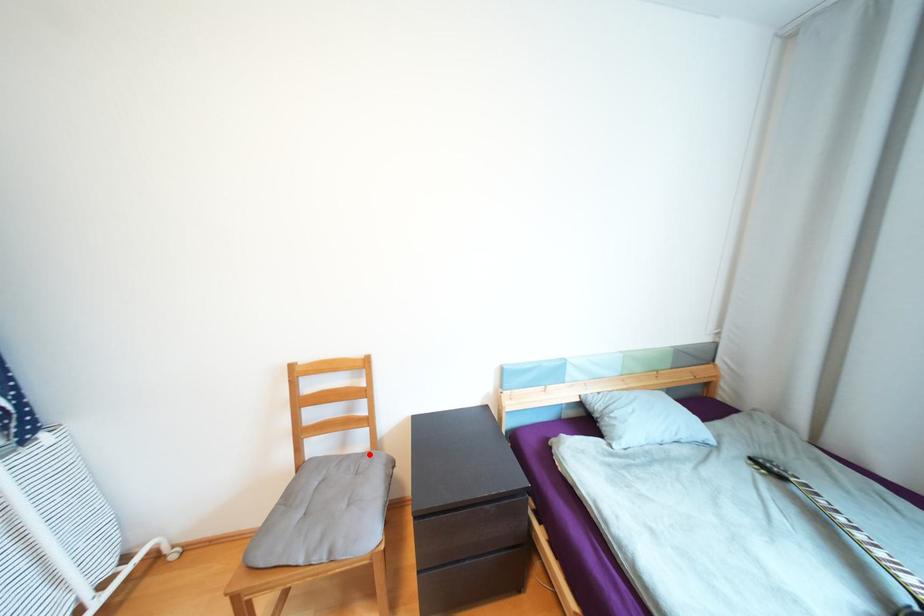
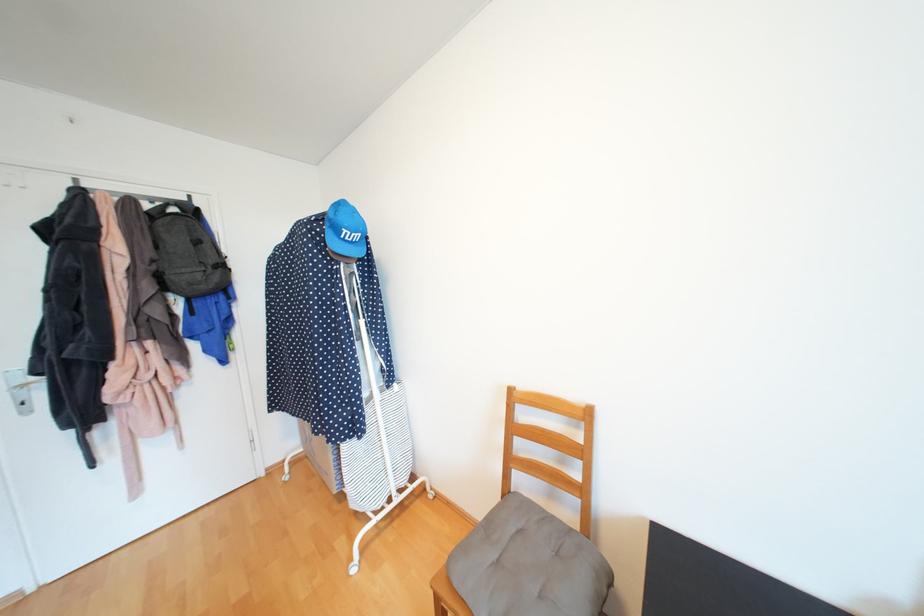
Where in the second image is the point corresponding to the highlighted location from the first image?

(577, 531)